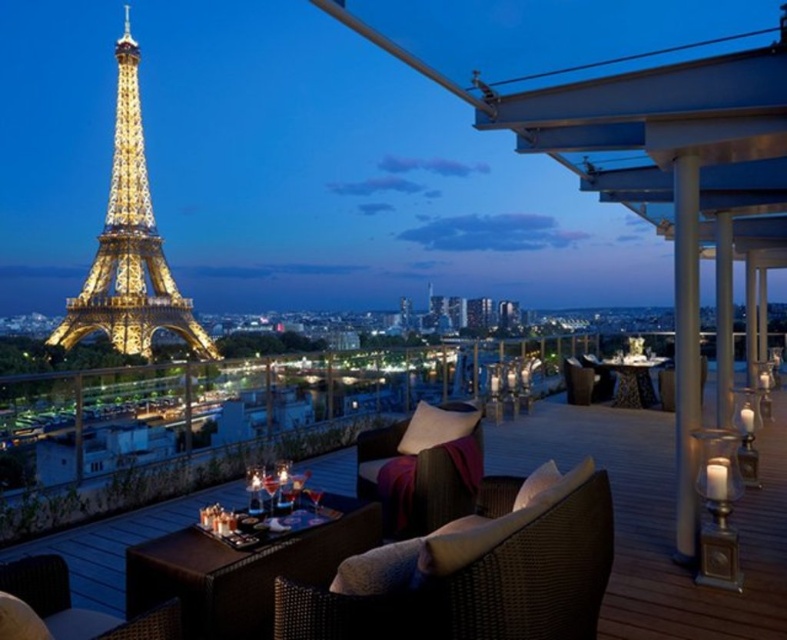
Question: Is the position of woven brown armchair at center more distant than that of gold metallic eiffel tower at left?

Choices:
 (A) no
 (B) yes

Answer: (A)

Question: Can you confirm if gold metallic eiffel tower at left is bigger than brown wicker armchair at lower left?

Choices:
 (A) no
 (B) yes

Answer: (B)

Question: Which object is farther from the camera taking this photo?

Choices:
 (A) gold metallic eiffel tower at left
 (B) brown wicker furniture at center
 (C) woven brown armchair at center
 (D) brown wicker armchair at lower left

Answer: (A)

Question: Which object appears farthest from the camera in this image?

Choices:
 (A) woven brown armchair at center
 (B) gold metallic eiffel tower at left
 (C) brown wicker furniture at center
 (D) brown wicker armchair at center

Answer: (B)

Question: Is brown wicker armchair at center positioned behind brown wicker armchair at lower left?

Choices:
 (A) no
 (B) yes

Answer: (B)

Question: Which of the following is the closest to the observer?

Choices:
 (A) brown wicker armchair at center
 (B) gold metallic eiffel tower at left
 (C) brown wicker armchair at lower left
 (D) woven brown armchair at center

Answer: (C)